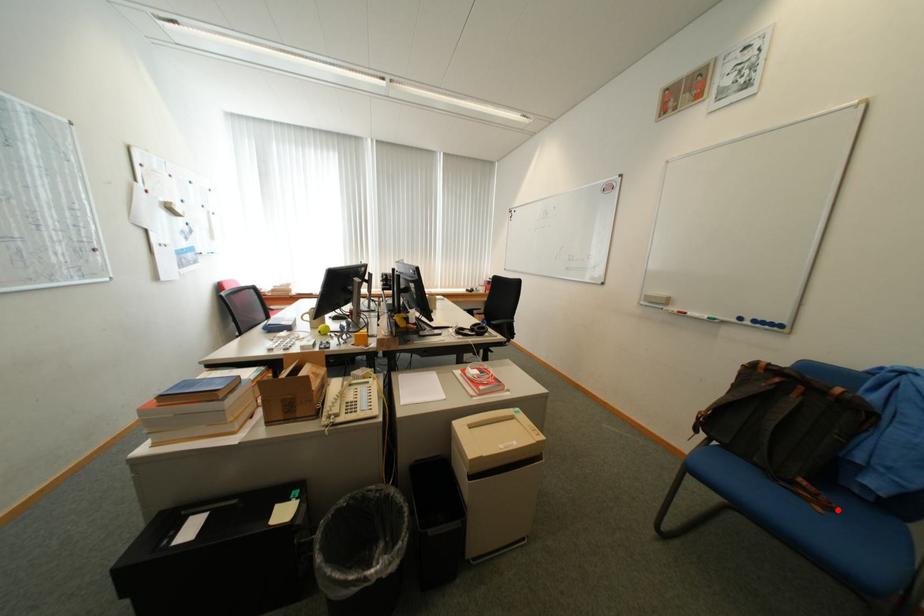
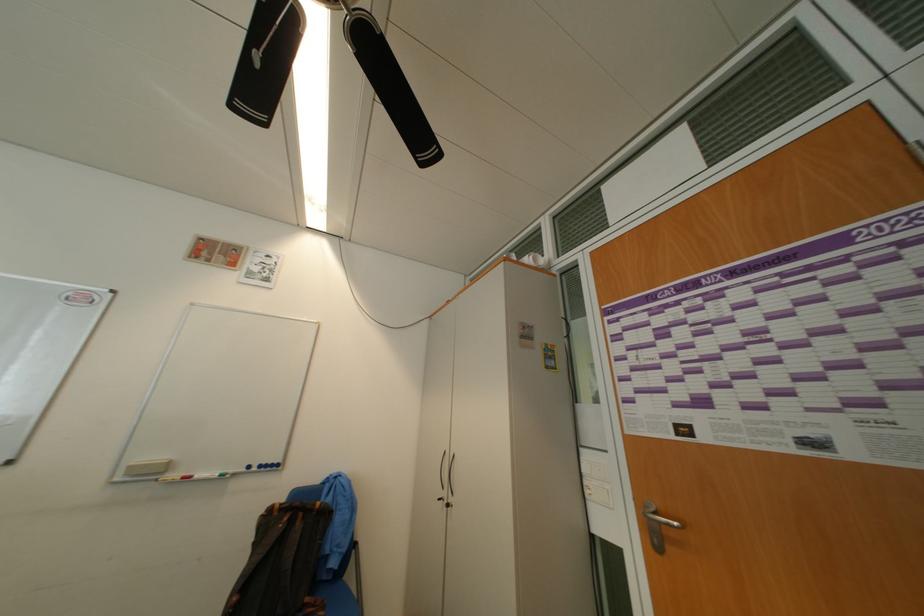
In the second image, find the point that corresponds to the highlighted location in the first image.

(334, 609)